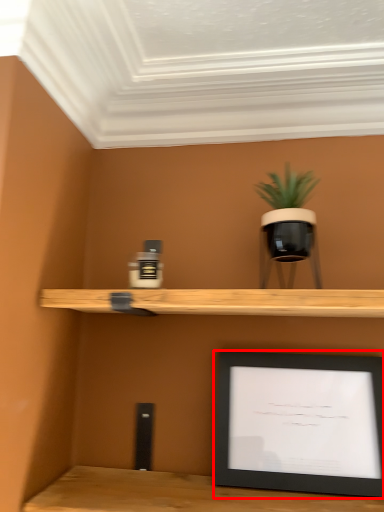
Question: Where is picture frame (annotated by the red box) located in relation to houseplant in the image?

Choices:
 (A) left
 (B) right

Answer: (B)